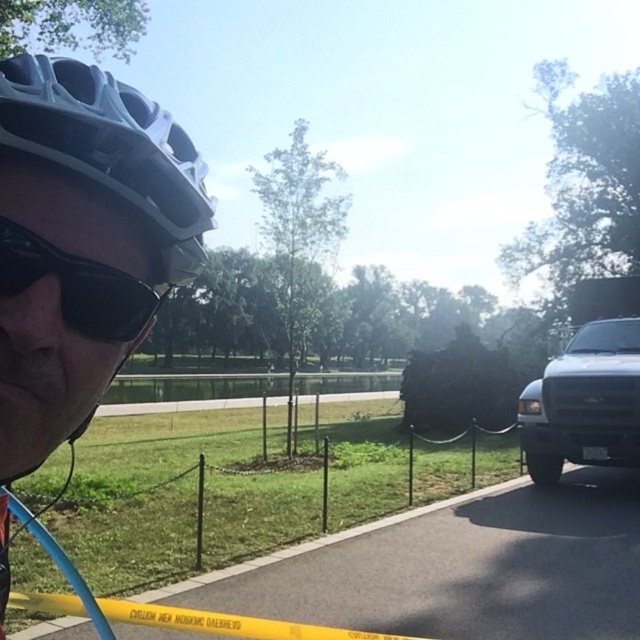
Is white matte helmet at upper left bigger than black matte truck at right?

No, white matte helmet at upper left is not bigger than black matte truck at right.

Does white matte helmet at upper left appear over black matte truck at right?

Yes.

Which is in front, point (61, 356) or point (576, 365)?

Point (61, 356)

Identify the location of white matte helmet at upper left. The height and width of the screenshot is (640, 640). (83, 243).

Between black matte truck at right and black matte sunglasses at upper left, which one appears on the right side from the viewer's perspective?

black matte truck at right

Can you confirm if black matte truck at right is positioned below black matte sunglasses at upper left?

Yes.

This screenshot has width=640, height=640. What do you see at coordinates (584, 403) in the screenshot?
I see `black matte truck at right` at bounding box center [584, 403].

In order to click on black matte truck at right in this screenshot , I will do `click(584, 403)`.

Is point (26, 220) behind point (138, 282)?

No, it is not.

Who is more forward, (x=129, y=241) or (x=115, y=317)?

Point (x=115, y=317) is more forward.

Identify the location of white matte helmet at upper left. (83, 243).